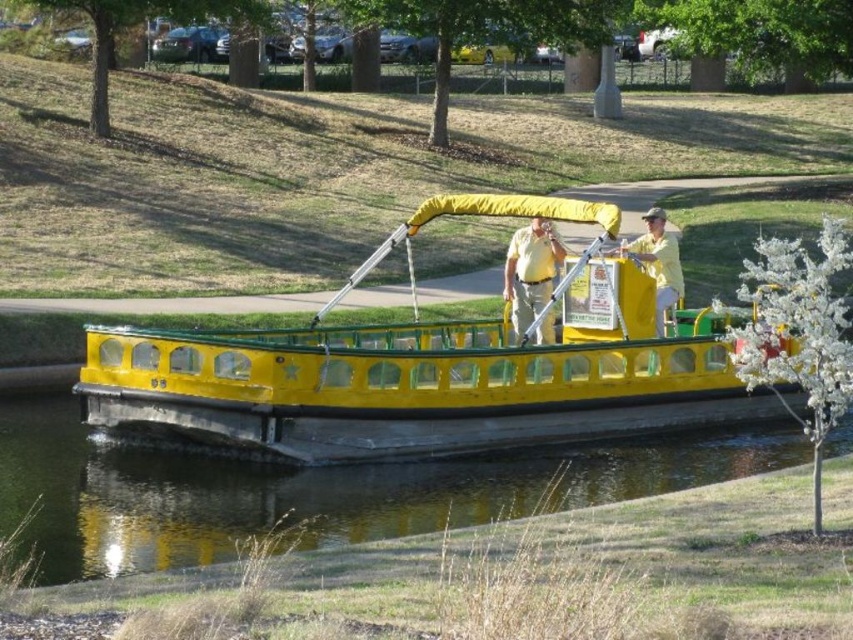
Does yellow matte boat at center have a smaller size compared to yellow matte shirt at upper center?

Correct, yellow matte boat at center occupies less space than yellow matte shirt at upper center.

Can you confirm if yellow matte boat at center is positioned to the right of yellow matte shirt at upper center?

No, yellow matte boat at center is not to the right of yellow matte shirt at upper center.

Locate an element on the screen. yellow matte boat at center is located at coordinates (425, 380).

What are the coordinates of `yellow matte boat at center` in the screenshot? It's located at (425, 380).

Is yellow matte boat at center positioned before yellow rubber boat at center?

No, it is not.

Is yellow matte boat at center to the right of yellow rubber boat at center from the viewer's perspective?

Indeed, yellow matte boat at center is positioned on the right side of yellow rubber boat at center.

Who is more distant from viewer, (587, 388) or (106, 538)?

Point (587, 388)

The height and width of the screenshot is (640, 853). I want to click on yellow matte boat at center, so click(425, 380).

Who is positioned more to the left, yellow matte shirt at center or yellow matte shirt at upper center?

yellow matte shirt at center

Can you confirm if yellow matte shirt at center is positioned below yellow matte shirt at upper center?

Correct, yellow matte shirt at center is located below yellow matte shirt at upper center.

You are a GUI agent. You are given a task and a screenshot of the screen. Output one action in this format:
    pyautogui.click(x=<x>, y=<y>)
    Task: Click on the yellow matte shirt at center
    
    Given the screenshot: What is the action you would take?
    pyautogui.click(x=531, y=272)